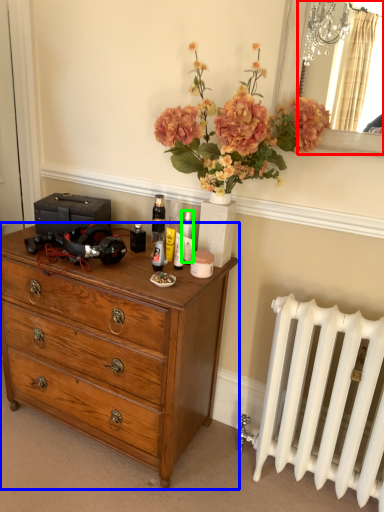
Question: Estimate the real-world distances between objects in this image. Which object is closer to mirror (highlighted by a red box), chest of drawers (highlighted by a blue box) or toiletry (highlighted by a green box)?

Choices:
 (A) chest of drawers
 (B) toiletry

Answer: (B)